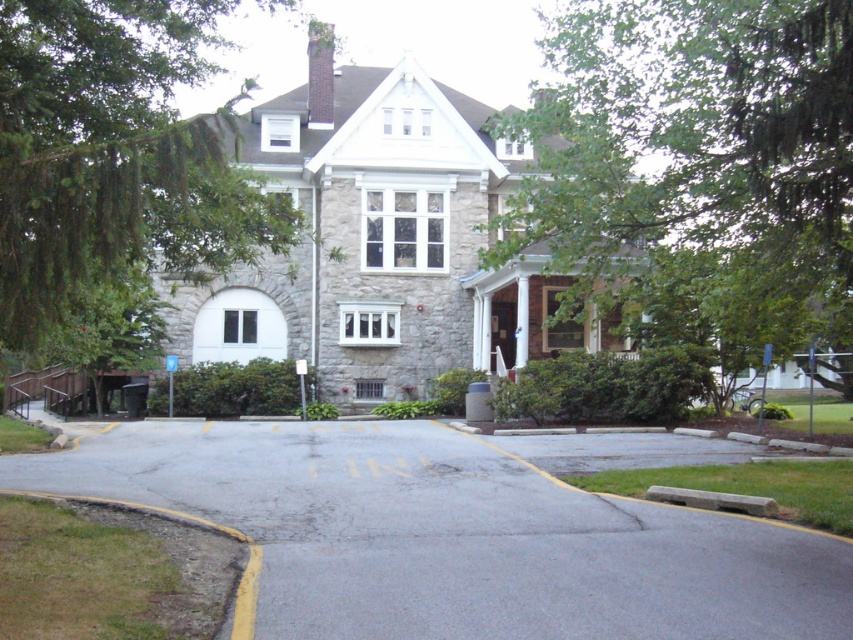
Is point (450, 448) positioned after point (792, 104)?

Yes, it is behind point (792, 104).

Is gray asphalt driveway at center shorter than green leafy tree at center?

Correct, gray asphalt driveway at center is not as tall as green leafy tree at center.

Where is `gray asphalt driveway at center`? gray asphalt driveway at center is located at coordinates (463, 531).

In the scene shown: Can you confirm if gray asphalt driveway at center is smaller than green leafy tree at left?

Indeed, gray asphalt driveway at center has a smaller size compared to green leafy tree at left.

Is point (380, 496) farther from viewer compared to point (125, 268)?

Yes, it is.

Image resolution: width=853 pixels, height=640 pixels. I want to click on gray asphalt driveway at center, so click(463, 531).

This screenshot has width=853, height=640. I want to click on gray asphalt driveway at center, so click(463, 531).

Who is positioned more to the left, green leafy tree at center or green leafy tree at left?

green leafy tree at left

Describe the element at coordinates (698, 168) in the screenshot. The height and width of the screenshot is (640, 853). I see `green leafy tree at center` at that location.

Identify the location of green leafy tree at center. click(698, 168).